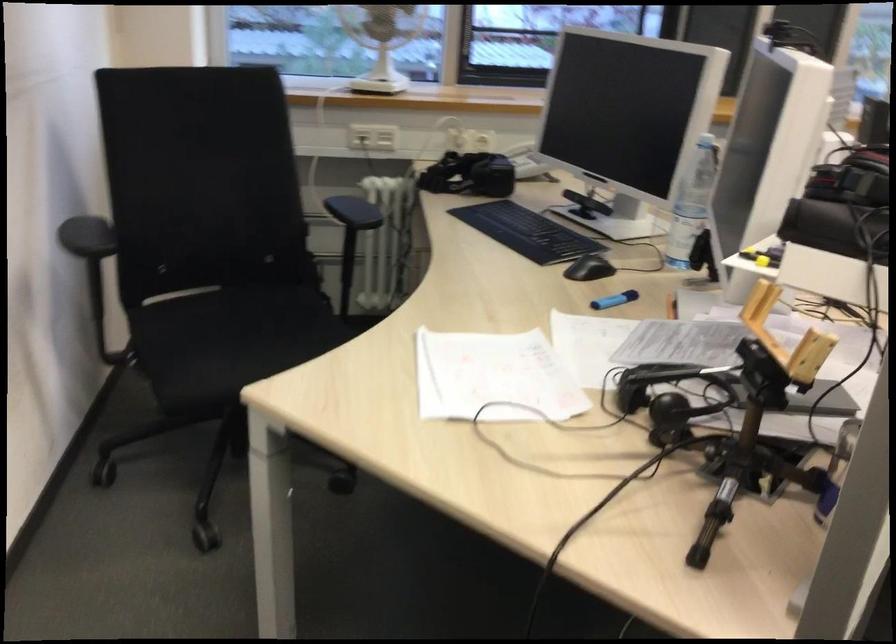
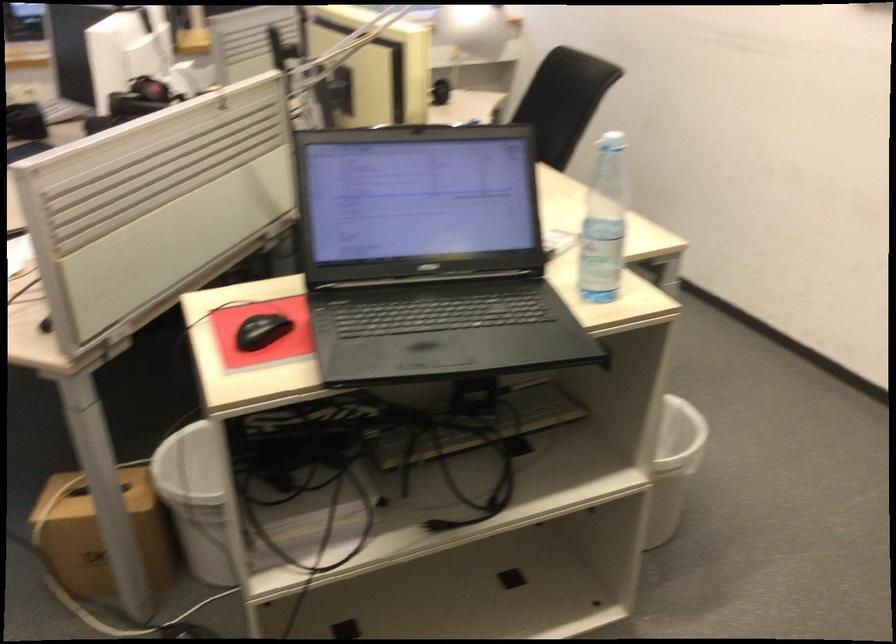
Question: I am providing you with two images of the same scene from different viewpoints. After the viewpoint changes to image2, which objects are now occluded?

Choices:
 (A) bed surface
 (B) plastic water bottle
 (C) computer mouse
 (D) black computer mouse

Answer: (C)